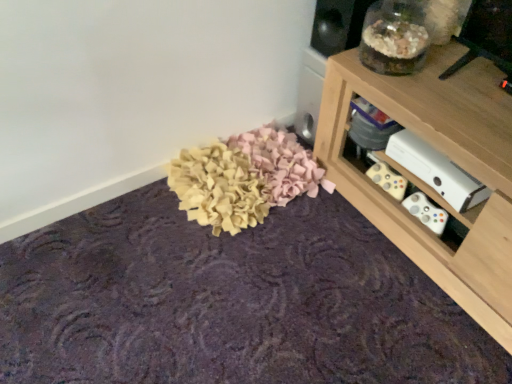
The width and height of the screenshot is (512, 384). I want to click on free space above felt-like fabric at center (from a real-world perspective), so click(257, 285).